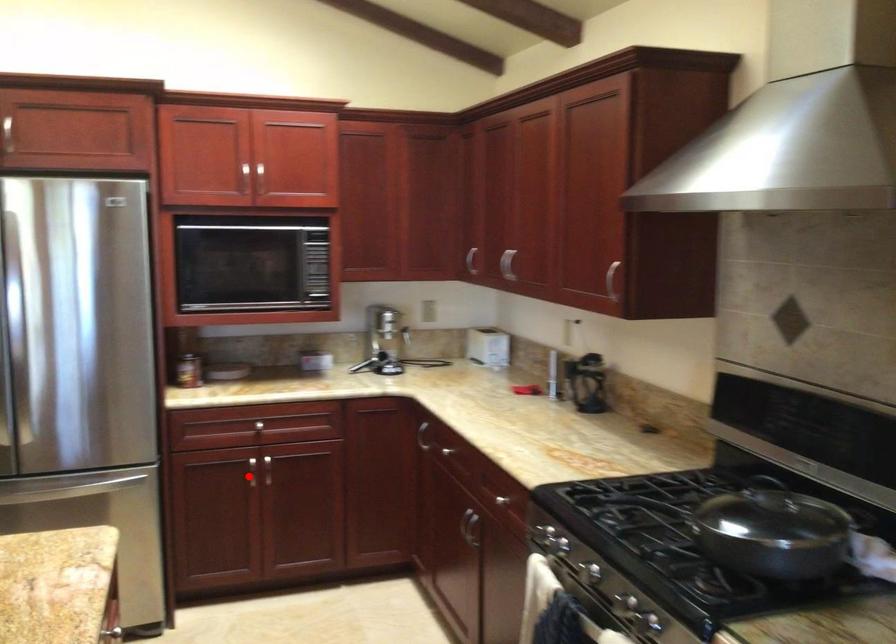
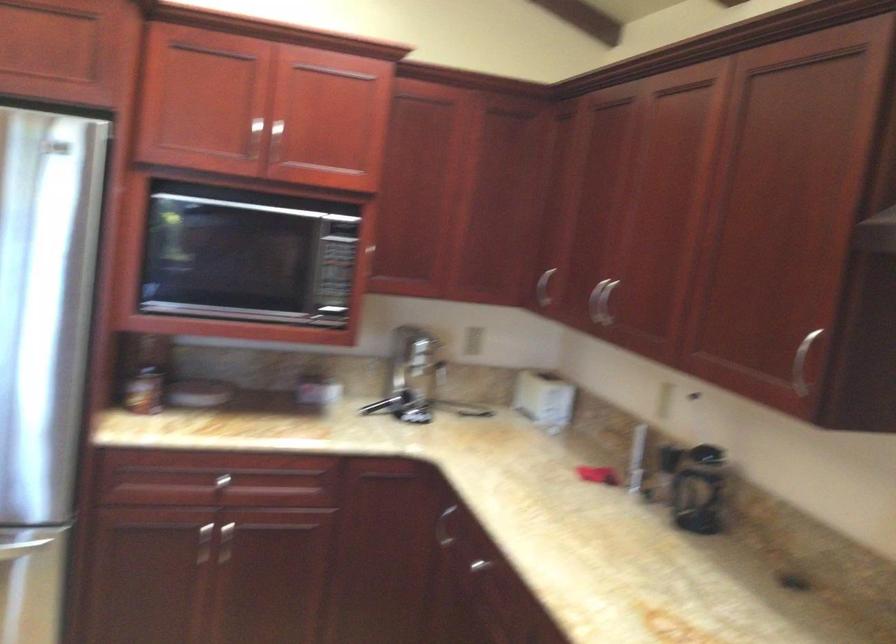
Question: I am providing you with two images of the same scene from different viewpoints. Image1 has a red point marked. In image2, the corresponding 3D location appears at what relative position? Reply with the corresponding letter.

Choices:
 (A) Closer
 (B) Farther

Answer: (A)